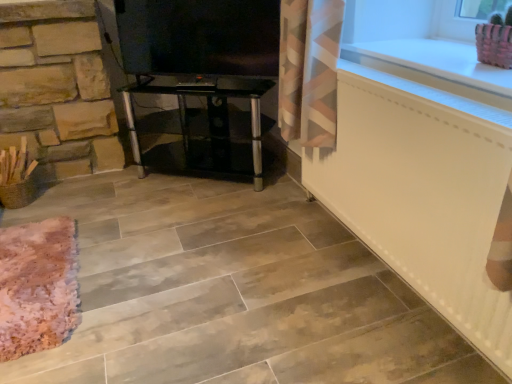
Question: Is white glossy counter top at upper right completely or partially inside pink fabric basket at upper right?

Choices:
 (A) yes
 (B) no

Answer: (B)

Question: From the image's perspective, is pink fabric basket at upper right beneath white glossy counter top at upper right?

Choices:
 (A) no
 (B) yes

Answer: (A)

Question: Does pink fabric basket at upper right turn towards white glossy counter top at upper right?

Choices:
 (A) no
 (B) yes

Answer: (A)

Question: Is pink fabric basket at upper right completely or partially outside of white glossy counter top at upper right?

Choices:
 (A) no
 (B) yes

Answer: (B)

Question: Is pink fabric basket at upper right shorter than white glossy counter top at upper right?

Choices:
 (A) yes
 (B) no

Answer: (B)

Question: Would you say pink fabric basket at upper right is a long distance from white glossy counter top at upper right?

Choices:
 (A) no
 (B) yes

Answer: (A)

Question: Can you confirm if white glossy counter top at upper right is wider than pink fabric basket at upper right?

Choices:
 (A) yes
 (B) no

Answer: (A)

Question: Does white glossy counter top at upper right touch pink fabric basket at upper right?

Choices:
 (A) yes
 (B) no

Answer: (B)

Question: Can you confirm if white glossy counter top at upper right is positioned to the left of pink fabric basket at upper right?

Choices:
 (A) no
 (B) yes

Answer: (B)

Question: Is the position of white glossy counter top at upper right more distant than that of pink fabric basket at upper right?

Choices:
 (A) no
 (B) yes

Answer: (A)

Question: Is white glossy counter top at upper right shorter than pink fabric basket at upper right?

Choices:
 (A) no
 (B) yes

Answer: (B)

Question: Does white glossy counter top at upper right appear on the right side of pink fabric basket at upper right?

Choices:
 (A) yes
 (B) no

Answer: (B)

Question: Is white matte radiator at lower right facing towards black glass tv stand at center?

Choices:
 (A) yes
 (B) no

Answer: (B)